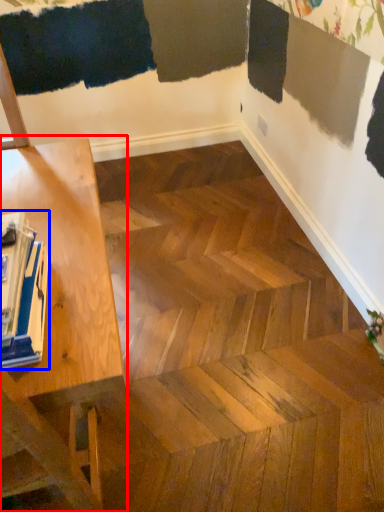
Question: Among these objects, which one is nearest to the camera, table (highlighted by a red box) or magazine (highlighted by a blue box)?

Choices:
 (A) table
 (B) magazine

Answer: (A)